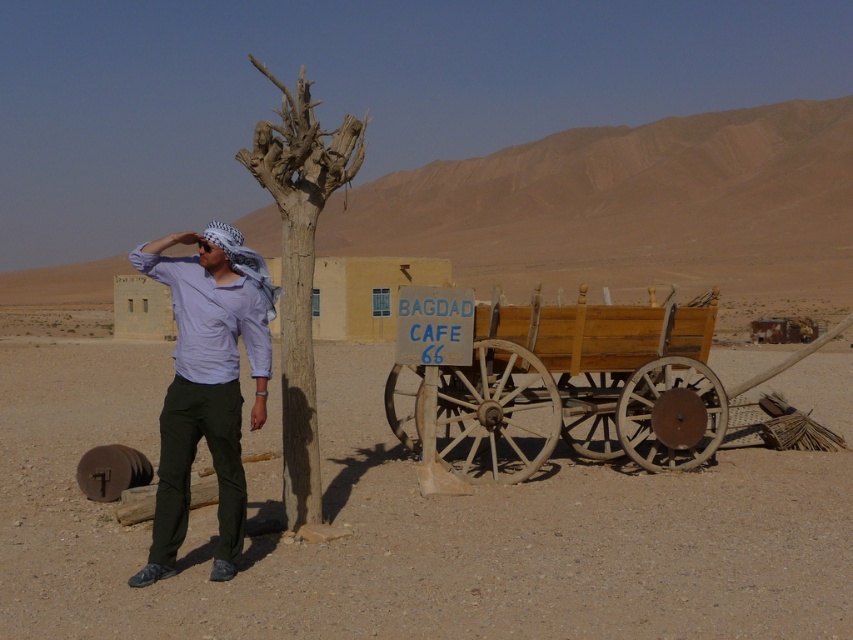
Question: Considering the relative positions of wooden wagon at center and brown rough tree at center in the image provided, where is wooden wagon at center located with respect to brown rough tree at center?

Choices:
 (A) right
 (B) left

Answer: (A)

Question: Is wooden wagon at center closer to the viewer compared to brown rough tree at center?

Choices:
 (A) no
 (B) yes

Answer: (A)

Question: Among these points, which one is nearest to the camera?

Choices:
 (A) (206, 312)
 (B) (540, 458)

Answer: (A)

Question: Is wooden wagon at center in front of matte purple shirt at left?

Choices:
 (A) yes
 (B) no

Answer: (B)

Question: Which point is closer to the camera taking this photo?

Choices:
 (A) (180, 396)
 (B) (352, 134)
 (C) (682, 316)

Answer: (A)

Question: Which is nearer to the brown rough tree at center?

Choices:
 (A) matte purple shirt at left
 (B) wooden wagon at center

Answer: (A)